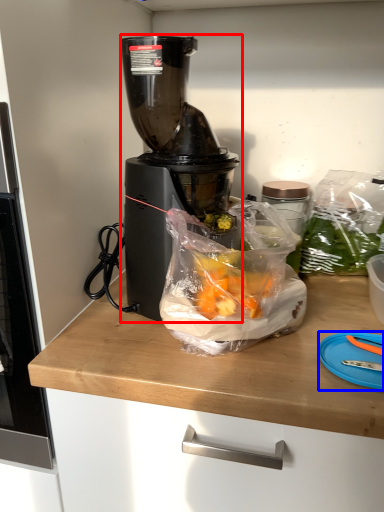
Question: Among these objects, which one is nearest to the camera, blender (highlighted by a red box) or cutting board (highlighted by a blue box)?

Choices:
 (A) blender
 (B) cutting board

Answer: (B)